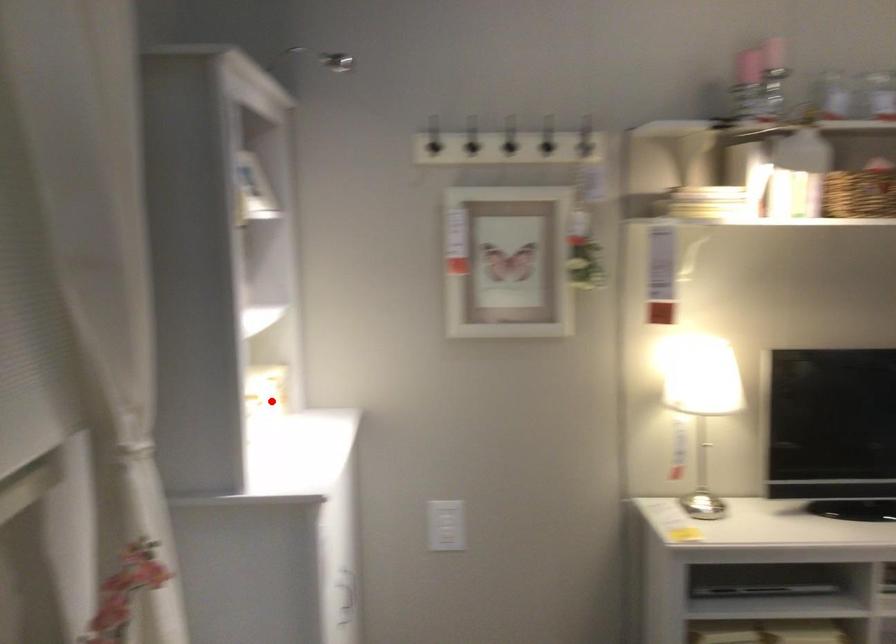
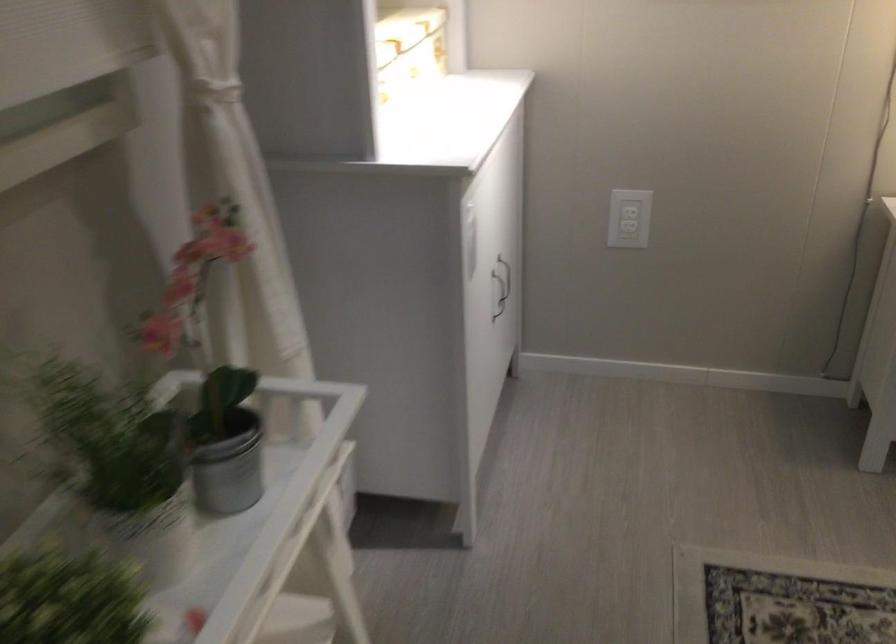
Locate, in the second image, the point that corresponds to the highlighted location in the first image.

(410, 44)